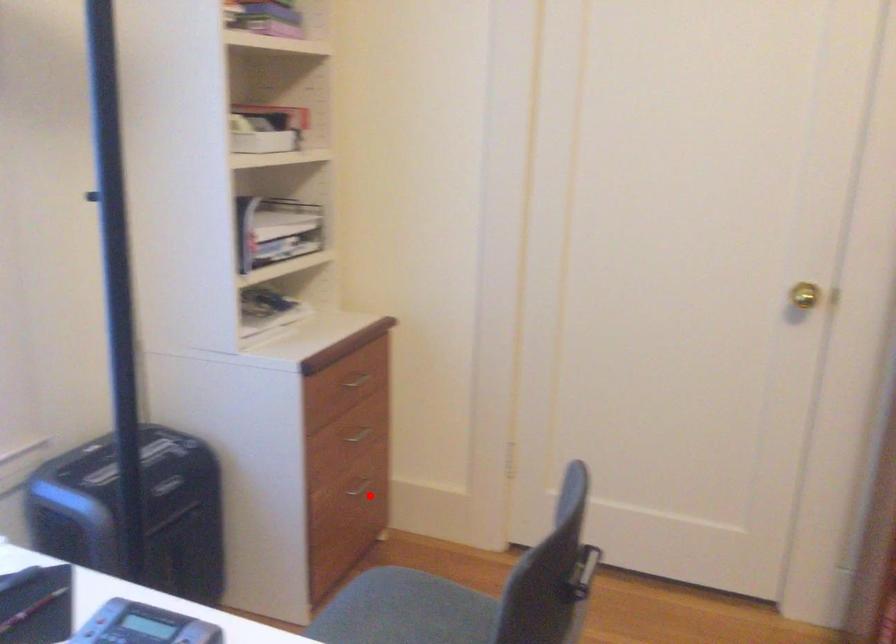
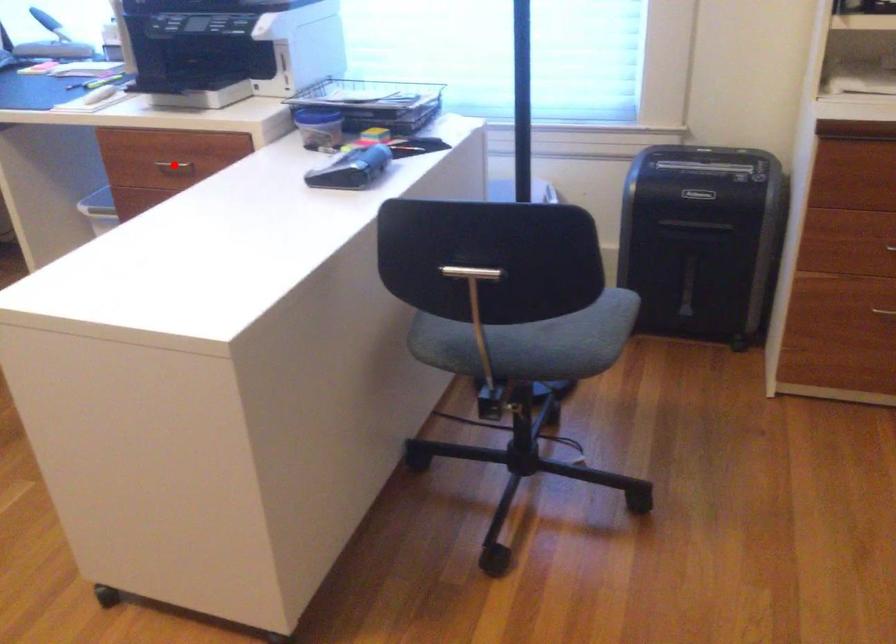
I am providing you with two images of the same scene from different viewpoints. A red point is marked on the first image and another point is marked on the second image. Is the marked point in image1 the same physical position as the marked point in image2?

No